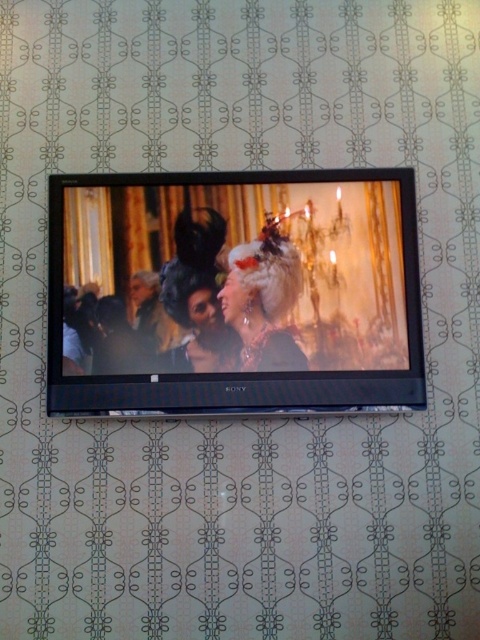
Does black glossy flat screen tv at center appear on the right side of shiny silver tiara at center?

Incorrect, black glossy flat screen tv at center is not on the right side of shiny silver tiara at center.

Does black glossy flat screen tv at center appear over shiny silver tiara at center?

Correct, black glossy flat screen tv at center is located above shiny silver tiara at center.

Who is more distant from viewer, (389, 250) or (302, 356)?

The point (389, 250) is behind.

You are a GUI agent. You are given a task and a screenshot of the screen. Output one action in this format:
    pyautogui.click(x=<x>, y=<y>)
    Task: Click on the black glossy flat screen tv at center
    This screenshot has height=640, width=480.
    Given the screenshot: What is the action you would take?
    pyautogui.click(x=233, y=292)